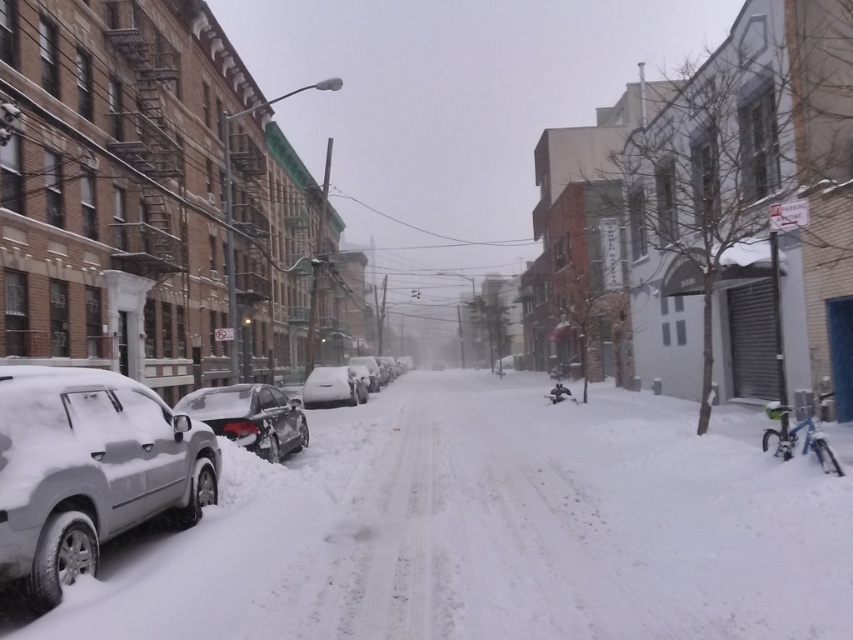
Question: Among these points, which one is farthest from the camera?

Choices:
 (A) (274, 461)
 (B) (524, 609)
 (C) (73, 433)

Answer: (A)

Question: Which object appears closest to the camera in this image?

Choices:
 (A) white fluffy snow at lower left
 (B) sleek metallic car at lower left
 (C) white matte car at center

Answer: (A)

Question: Does sleek silver suv at left have a greater width compared to white matte car at center?

Choices:
 (A) no
 (B) yes

Answer: (A)

Question: Does white fluffy snow at lower left appear under sleek silver suv at left?

Choices:
 (A) no
 (B) yes

Answer: (B)

Question: Is white fluffy snow at lower left in front of sleek metallic car at lower left?

Choices:
 (A) yes
 (B) no

Answer: (A)

Question: Which point is closer to the camera taking this photo?

Choices:
 (A) (218, 604)
 (B) (332, 365)
 (C) (140, 388)
 (D) (286, 422)

Answer: (A)